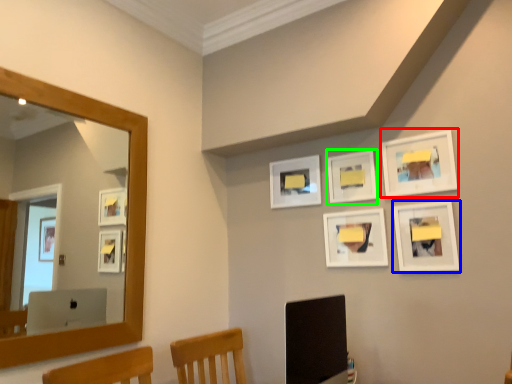
Question: Which is nearer to the picture frame (highlighted by a red box)? picture frame (highlighted by a blue box) or picture frame (highlighted by a green box).

Choices:
 (A) picture frame
 (B) picture frame

Answer: (A)